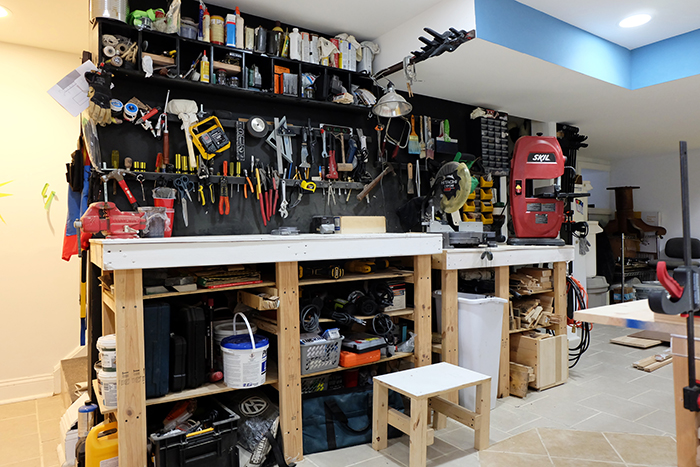
You are a GUI agent. You are given a task and a screenshot of the screen. Output one action in this format:
    pyautogui.click(x=<x>, y=<y>)
    Task: Click on the light
    This screenshot has width=700, height=467.
    Given the screenshot: What is the action you would take?
    pyautogui.click(x=654, y=25)